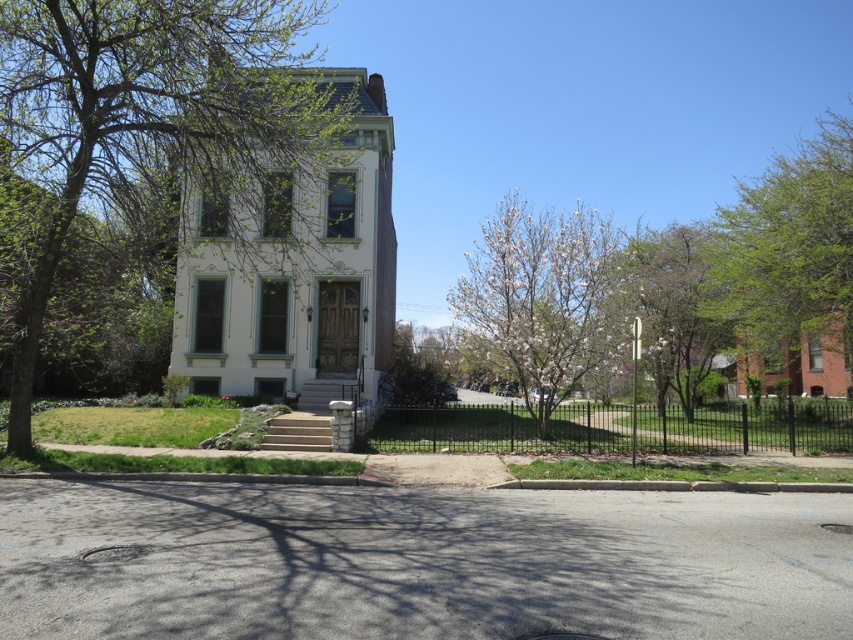
You are a gardener who wants to plant a new tree in the front yard of the house. You have two options from the image, the white blossoming tree at center and the smooth white blossoms at center. Which one requires more space due to its size?

The white blossoming tree at center is larger in size than the smooth white blossoms at center, so it requires more space.

You are standing at the entrance of the house and want to walk directly towards the green leafy tree at center. Which direction should you face to walk straight towards it?

The green leafy tree at center is located at coordinates point [160,124], so you should face towards the direction of the tree to walk straight towards it.

From the picture: You are standing at the entrance of the two story residential building and looking towards the green leafy tree at center. What is the direction of the tree relative to your position?

The green leafy tree at center is located at point (160, 124), which is to the center of the image. Since you are at the entrance facing the building, the tree would be directly in front of you, centered in your field of view.